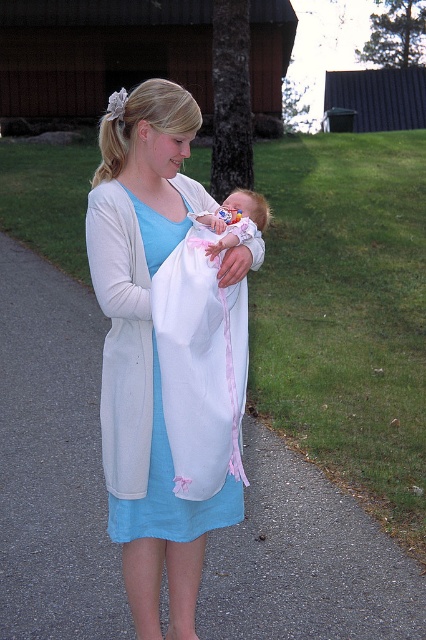
You are a photographer trying to capture the scene where the woman and baby are positioned. You want to ensure the white cotton dress at center and the pink fabric baby at center are both visible in the frame. Which object should you focus on first to ensure both are in focus?

The white cotton dress at center is below the pink fabric baby at center, so focusing on the pink fabric baby at center first will ensure both are in focus since it is higher up and the dress is closer to the camera.

You are a photographer setting up a shot of the scene. You need to ensure that both the white cotton dress at center and the pink fabric baby at center are in focus simultaneously. Given that your camera has a depth of field that can cover 40 inches, will you be able to achieve this?

The distance between the white cotton dress at center and the pink fabric baby at center is 38.90 inches, which is within the camera depth of field of 40 inches. Therefore, both objects can be in focus simultaneously.

You are a photographer trying to capture a portrait of the woman and baby. You want to ensure the white cotton dress at center is clearly visible in the frame. Given that the pink fabric baby at center is smaller, where should you position the camera relative to the woman to best highlight the dress?

Since the white cotton dress at center is taller than the pink fabric baby at center, positioning the camera slightly above the woman and baby will allow the dress to be more prominent in the frame while still including the baby.